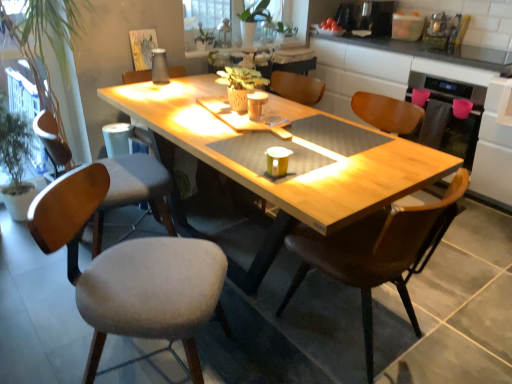
The width and height of the screenshot is (512, 384). In order to click on vacant space that is to the left of matte brown coffee cup at center, placed as the first coffee cup when sorted from back to front in this screenshot , I will do `click(230, 115)`.